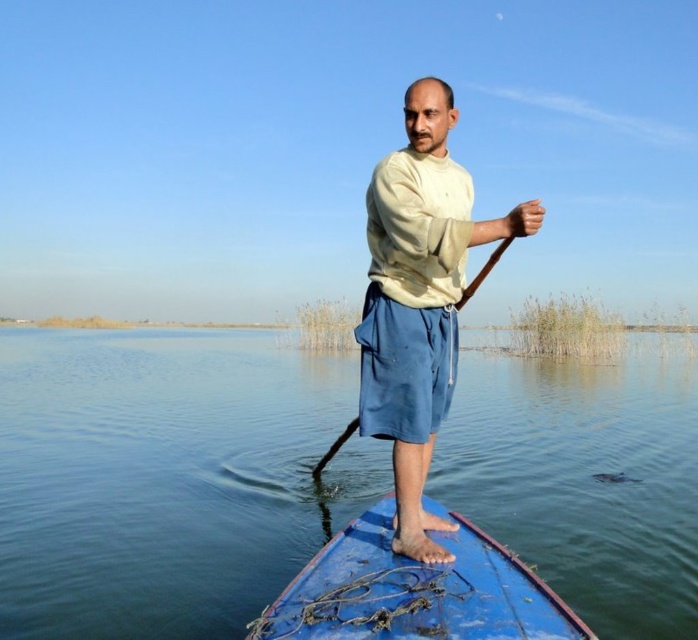
Which of these two, blue water at center or beige cotton shirt at center, stands taller?

blue water at center is taller.

Can you confirm if blue water at center is taller than beige cotton shirt at center?

Yes, blue water at center is taller than beige cotton shirt at center.

From the picture: Who is more distant from viewer, (107, 636) or (408, 180)?

Positioned behind is point (107, 636).

I want to click on blue water at center, so click(x=165, y=477).

Is blue water at center shorter than wooden paddle at center?

In fact, blue water at center may be taller than wooden paddle at center.

Who is more forward, (285,481) or (350,420)?

Positioned in front is point (350,420).

Locate an element on the screen. Image resolution: width=698 pixels, height=640 pixels. blue water at center is located at coordinates (165, 477).

Where is `blue water at center`? The width and height of the screenshot is (698, 640). blue water at center is located at coordinates (165, 477).

Can you confirm if beige cotton shirt at center is taller than blue wooden canoe at center?

Yes, beige cotton shirt at center is taller than blue wooden canoe at center.

Is point (447, 86) positioned behind point (357, 600)?

That is True.

Locate an element on the screen. The width and height of the screenshot is (698, 640). beige cotton shirt at center is located at coordinates (417, 300).